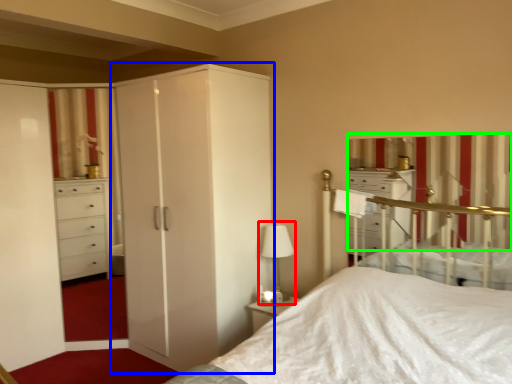
Question: Estimate the real-world distances between objects in this image. Which object is farther from table lamp (highlighted by a red box), cupboard (highlighted by a blue box) or curtain (highlighted by a green box)?

Choices:
 (A) cupboard
 (B) curtain

Answer: (B)